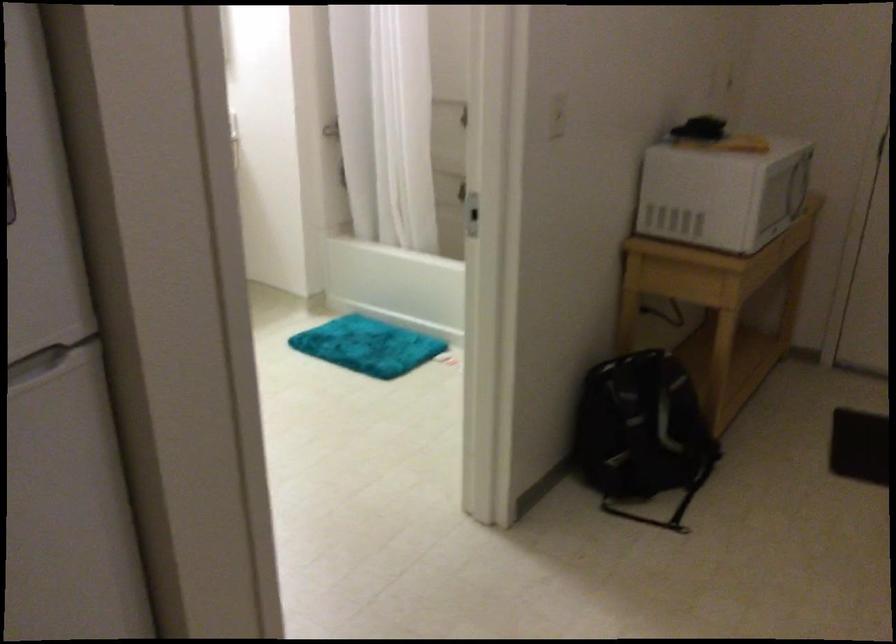
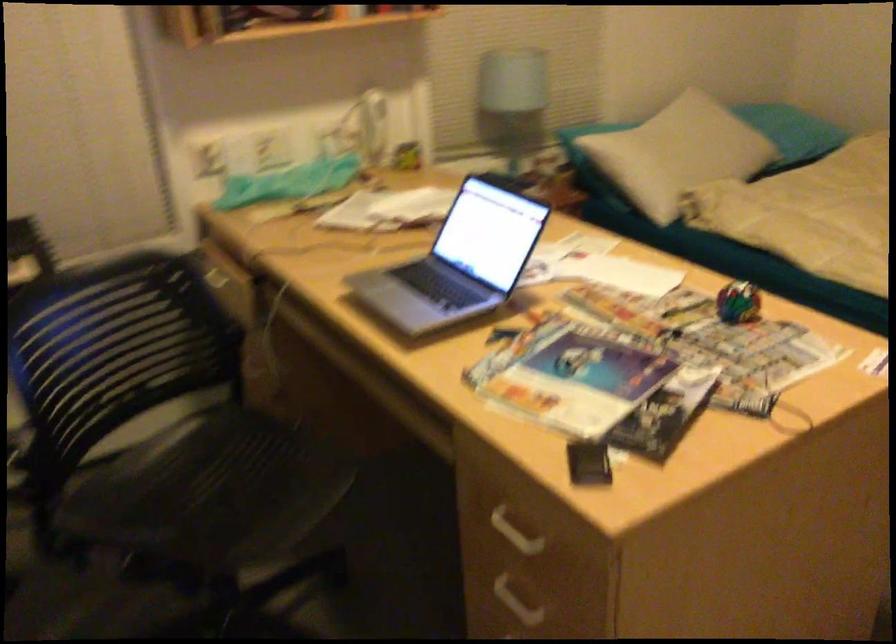
First-person continuous shooting, in which direction is the camera rotating?

The camera's rotation is toward left-down.